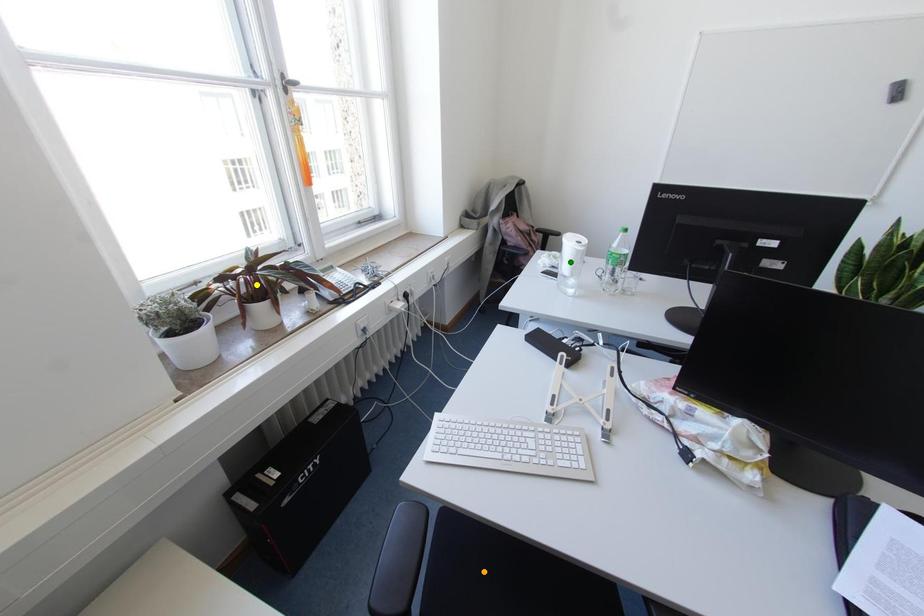
Order these from nearest to farthest:
orange point
green point
yellow point

orange point
yellow point
green point